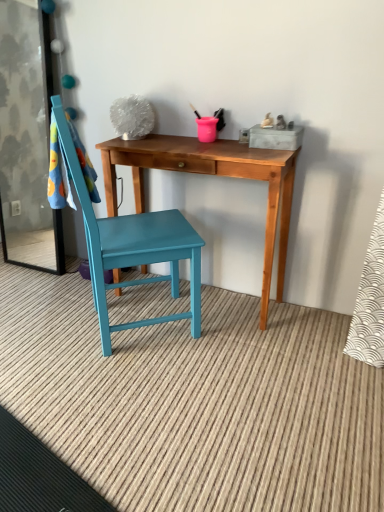
Question: Is wooden desk at center bigger or smaller than transparent glass screen door at left?

Choices:
 (A) big
 (B) small

Answer: (A)

Question: In the image, is wooden desk at center positioned in front of or behind transparent glass screen door at left?

Choices:
 (A) front
 (B) behind

Answer: (A)

Question: Estimate the real-world distances between objects in this image. Which object is farther from the teal painted wood chair at center?

Choices:
 (A) transparent glass screen door at left
 (B) wooden desk at center

Answer: (A)

Question: Which object is the closest to the wooden desk at center?

Choices:
 (A) transparent glass screen door at left
 (B) teal painted wood chair at center

Answer: (B)